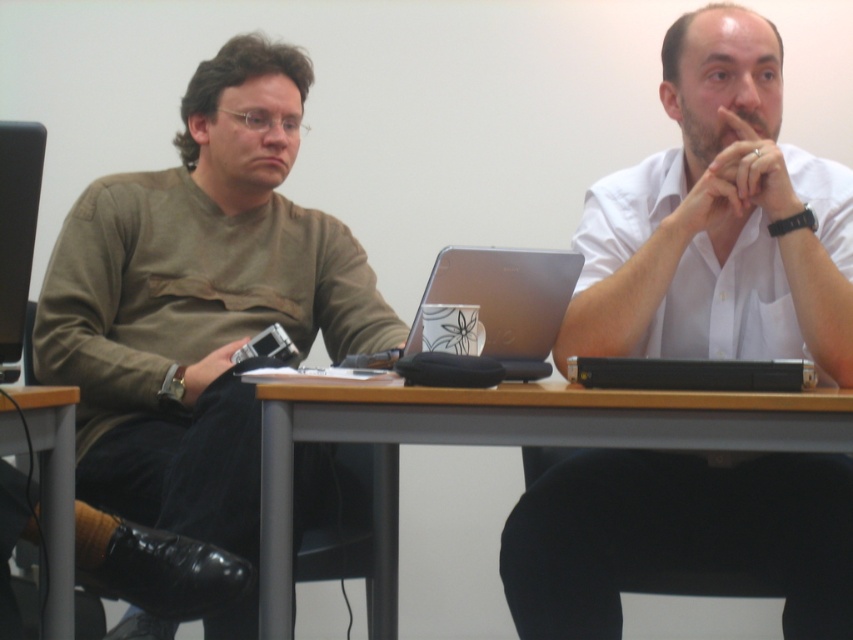
Which is below, matte brown shirt at left or black plastic laptop at left?

matte brown shirt at left

Can you confirm if matte brown shirt at left is wider than black plastic laptop at left?

Indeed, matte brown shirt at left has a greater width compared to black plastic laptop at left.

The width and height of the screenshot is (853, 640). What are the coordinates of `matte brown shirt at left` in the screenshot? It's located at (198, 301).

Locate an element on the screen. The image size is (853, 640). matte brown shirt at left is located at coordinates (198, 301).

You are a GUI agent. You are given a task and a screenshot of the screen. Output one action in this format:
    pyautogui.click(x=<x>, y=<y>)
    Task: Click on the metallic gray table at lower left
    The width and height of the screenshot is (853, 640).
    Given the screenshot: What is the action you would take?
    pyautogui.click(x=48, y=484)

Is metallic gray table at lower left further to camera compared to black plastic laptop at left?

No, it is in front of black plastic laptop at left.

Which is behind, point (61, 470) or point (15, 304)?

Point (61, 470)

The image size is (853, 640). In order to click on metallic gray table at lower left in this screenshot , I will do `click(48, 484)`.

Can you confirm if wooden at center is positioned above black plastic laptop at left?

No, wooden at center is not above black plastic laptop at left.

Who is lower down, wooden at center or black plastic laptop at left?

wooden at center

Is point (662, 440) farther from camera compared to point (35, 221)?

No.

Where is `wooden at center`? Image resolution: width=853 pixels, height=640 pixels. wooden at center is located at coordinates (496, 444).